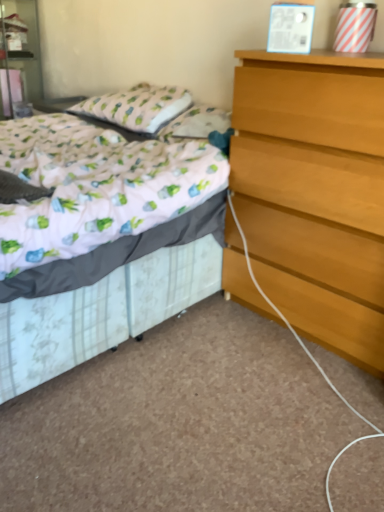
Question: Can you confirm if matte white nightstand at upper left is wider than patterned fabric pillow at upper left?

Choices:
 (A) yes
 (B) no

Answer: (A)

Question: Is matte white nightstand at upper left positioned before patterned fabric pillow at upper left?

Choices:
 (A) yes
 (B) no

Answer: (B)

Question: From a real-world perspective, is matte white nightstand at upper left physically above patterned fabric pillow at upper left?

Choices:
 (A) yes
 (B) no

Answer: (A)

Question: Can you confirm if matte white nightstand at upper left is bigger than patterned fabric pillow at upper left?

Choices:
 (A) yes
 (B) no

Answer: (A)

Question: From the image's perspective, does matte white nightstand at upper left appear lower than patterned fabric pillow at upper left?

Choices:
 (A) yes
 (B) no

Answer: (B)

Question: From the image's perspective, does matte white nightstand at upper left appear higher than patterned fabric pillow at upper left?

Choices:
 (A) no
 (B) yes

Answer: (B)

Question: Is light brown wooden chest of drawers at right closer to camera compared to white floral fabric bed at center?

Choices:
 (A) no
 (B) yes

Answer: (A)

Question: From a real-world perspective, is light brown wooden chest of drawers at right positioned under white floral fabric bed at center based on gravity?

Choices:
 (A) yes
 (B) no

Answer: (B)

Question: Would you say white floral fabric bed at center is part of light brown wooden chest of drawers at right's contents?

Choices:
 (A) no
 (B) yes

Answer: (A)

Question: Considering the relative sizes of light brown wooden chest of drawers at right and white floral fabric bed at center in the image provided, is light brown wooden chest of drawers at right shorter than white floral fabric bed at center?

Choices:
 (A) yes
 (B) no

Answer: (B)

Question: Is light brown wooden chest of drawers at right not inside white floral fabric bed at center?

Choices:
 (A) no
 (B) yes

Answer: (B)

Question: Can you confirm if light brown wooden chest of drawers at right is positioned to the left of white floral fabric bed at center?

Choices:
 (A) no
 (B) yes

Answer: (A)

Question: Considering the relative positions of white floral fabric bed at center and matte white nightstand at upper left in the image provided, is white floral fabric bed at center to the right of matte white nightstand at upper left from the viewer's perspective?

Choices:
 (A) yes
 (B) no

Answer: (A)